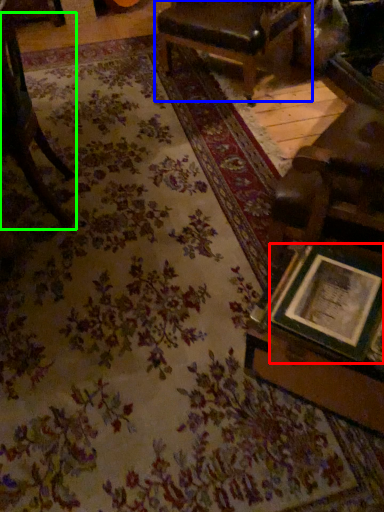
Question: Which object is positioned farthest from picture frame (highlighted by a red box)? Select from chair (highlighted by a blue box) and chair (highlighted by a green box).

Choices:
 (A) chair
 (B) chair

Answer: (A)